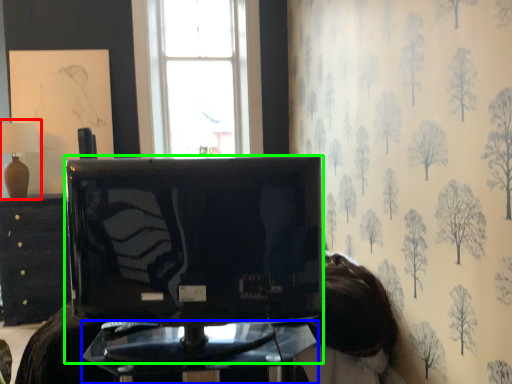
Question: Considering the real-world distances, which object is closest to table lamp (highlighted by a red box)? furniture (highlighted by a blue box) or television (highlighted by a green box).

Choices:
 (A) furniture
 (B) television

Answer: (B)